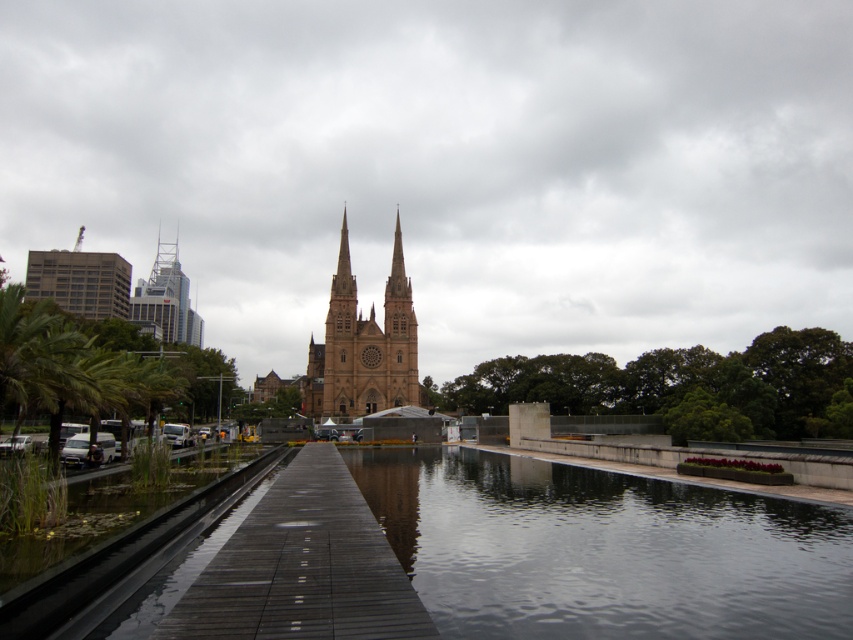
Find the location of a particular element. The height and width of the screenshot is (640, 853). smooth concrete river at center is located at coordinates (602, 550).

Is smooth concrete river at center closer to camera compared to brown stone tower at center?

Yes.

Locate an element on the screen. The height and width of the screenshot is (640, 853). smooth concrete river at center is located at coordinates (602, 550).

Who is positioned more to the left, smooth concrete river at center or dark gray wooden train track at lower left?

dark gray wooden train track at lower left

This screenshot has width=853, height=640. Find the location of `smooth concrete river at center`. smooth concrete river at center is located at coordinates (602, 550).

At what (x,y) coordinates should I click in order to perform the action: click on brown stone tower at center. Please return your answer as a coordinate pair (x, y). The height and width of the screenshot is (640, 853). Looking at the image, I should click on (363, 346).

Who is more distant from viewer, (412, 369) or (141, 308)?

Positioned behind is point (141, 308).

Is point (335, 353) closer to viewer compared to point (161, 269)?

Yes.

Find the location of `brown stone tower at center`. brown stone tower at center is located at coordinates (363, 346).